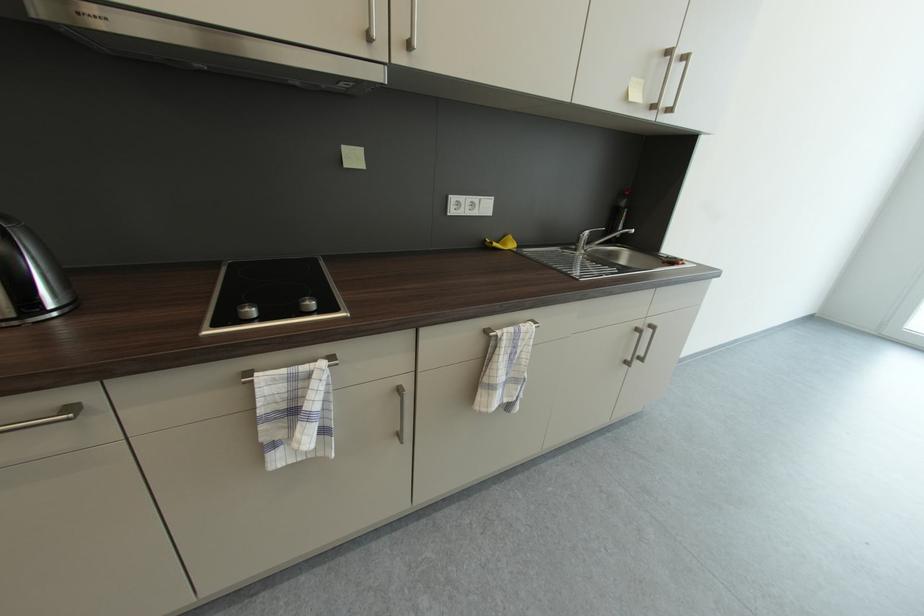
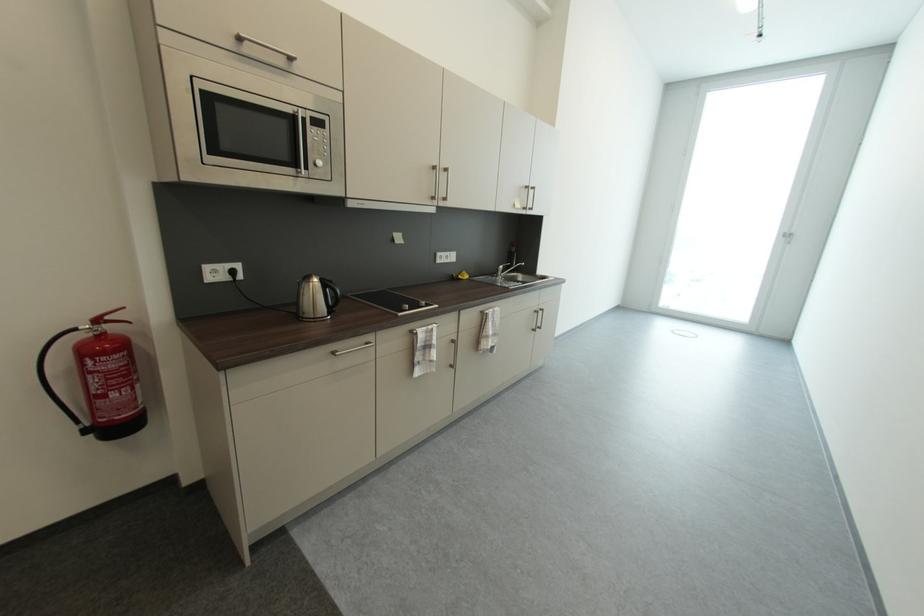
The point at (579, 248) is marked in the first image. Where is the corresponding point in the second image?

(502, 277)